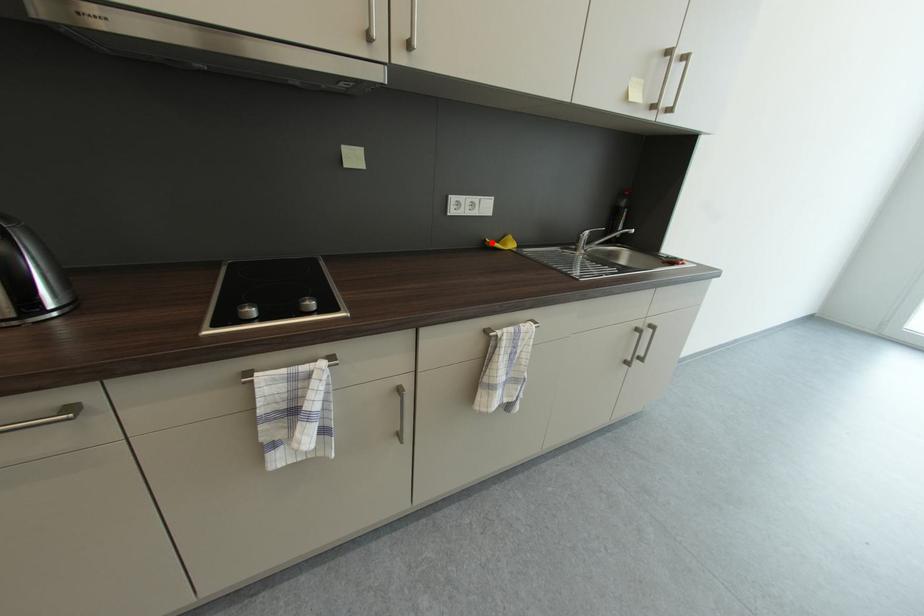
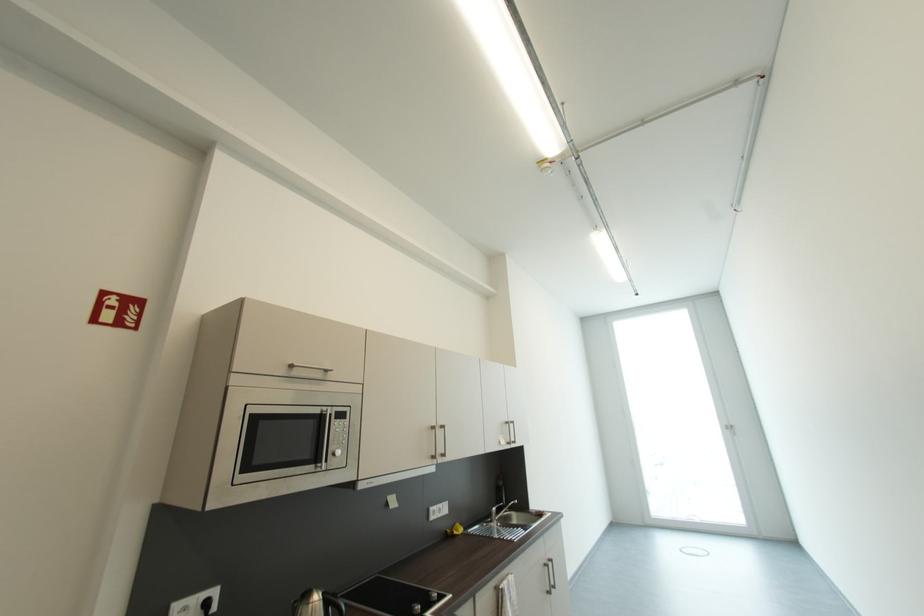
Locate, in the second image, the point that corresponds to the highlighted location in the first image.

(454, 533)